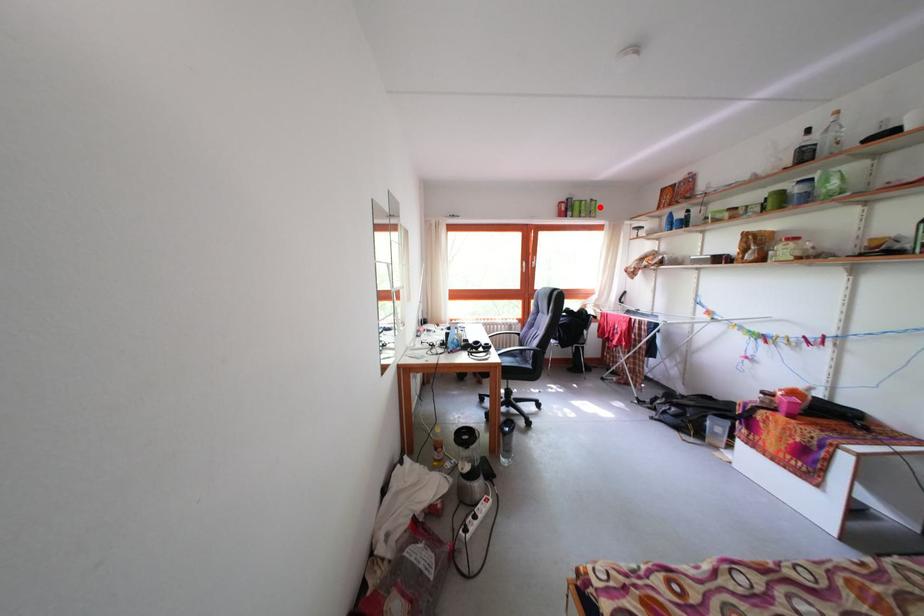
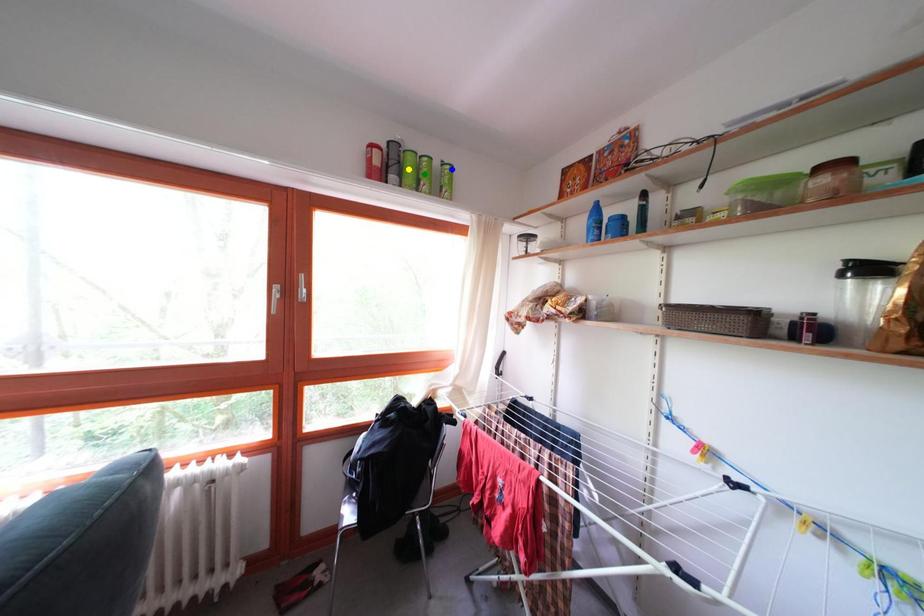
Question: I am providing you with two images of the same scene from different viewpoints. A red point is marked on the first image. You are given multiple points on the second image. Which point in image 2 is actually the same real-world point as the red point in image 1?

Choices:
 (A) blue point
 (B) yellow point
 (C) green point

Answer: (A)